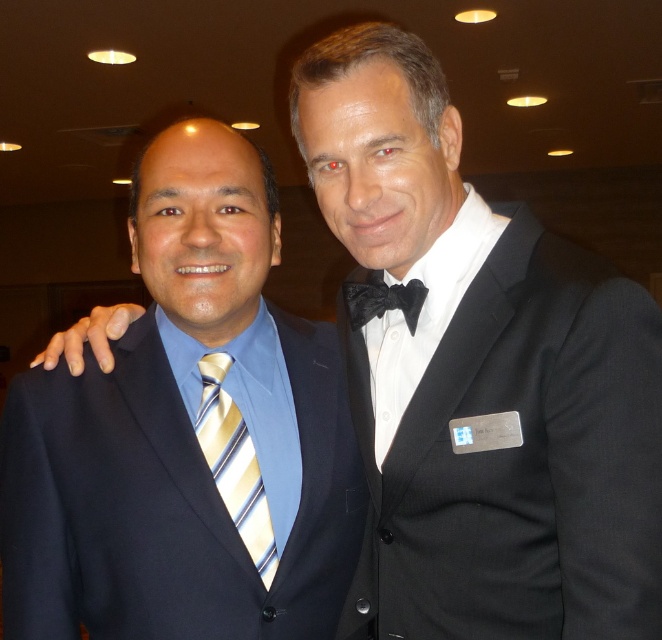
Is navy blue suit at left positioned in front of black satin bow tie at center?

Yes, navy blue suit at left is closer to the viewer.

Is point (9, 422) less distant than point (426, 289)?

No, it is not.

Where is `navy blue suit at left`? This screenshot has width=662, height=640. navy blue suit at left is located at coordinates (187, 435).

Does black satin bow tie at right have a lesser width compared to black satin bow tie at center?

No.

Does black satin bow tie at right appear over black satin bow tie at center?

Incorrect, black satin bow tie at right is not positioned above black satin bow tie at center.

Does point (643, 484) come in front of point (412, 317)?

Yes, point (643, 484) is in front of point (412, 317).

Image resolution: width=662 pixels, height=640 pixels. Find the location of `black satin bow tie at right`. black satin bow tie at right is located at coordinates (577, 369).

Does navy blue suit at left have a lesser width compared to black satin bow tie at right?

No, navy blue suit at left is not thinner than black satin bow tie at right.

Does navy blue suit at left appear on the left side of black satin bow tie at right?

Correct, you'll find navy blue suit at left to the left of black satin bow tie at right.

Between point (103, 634) and point (483, 474), which one is positioned in front?

Point (483, 474) is in front.

The width and height of the screenshot is (662, 640). In order to click on navy blue suit at left in this screenshot , I will do `click(187, 435)`.